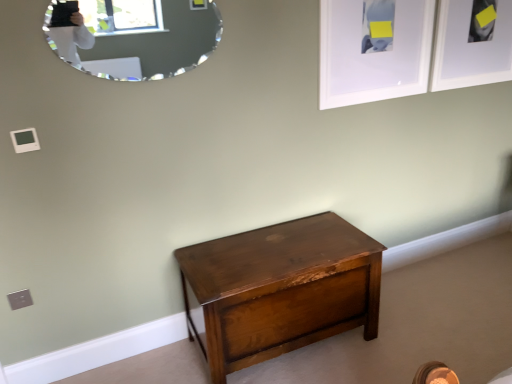
Where is `white matte picture frame at upper right, the second picture frame when ordered from right to left`? The image size is (512, 384). white matte picture frame at upper right, the second picture frame when ordered from right to left is located at coordinates (374, 50).

The height and width of the screenshot is (384, 512). Find the location of `white matte picture frame at upper right, which appears as the 2th picture frame when viewed from the left`. white matte picture frame at upper right, which appears as the 2th picture frame when viewed from the left is located at coordinates click(472, 43).

This screenshot has height=384, width=512. I want to click on silver-framed mirror at upper left, so click(x=136, y=37).

Which is closer, (260,264) or (203,15)?

Point (260,264) is positioned farther from the camera compared to point (203,15).

This screenshot has height=384, width=512. In order to click on mirror to the left of shiny brown wood chest at center in this screenshot , I will do `click(136, 37)`.

Is shiny brown wood chest at center facing towards silver-framed mirror at upper left?

No, shiny brown wood chest at center is not oriented towards silver-framed mirror at upper left.

Looking at this image, from a real-world perspective, which is physically above, shiny brown wood chest at center or silver-framed mirror at upper left?

silver-framed mirror at upper left, from a real-world perspective.

Is white matte picture frame at upper right, the second picture frame when ordered from right to left, facing away from silver-framed mirror at upper left?

white matte picture frame at upper right, the second picture frame when ordered from right to left, does not have its back to silver-framed mirror at upper left.

Who is shorter, white matte picture frame at upper right, the 1th picture frame positioned from the left, or silver-framed mirror at upper left?

silver-framed mirror at upper left is shorter.

Is white matte picture frame at upper right, the 1th picture frame positioned from the left, inside or outside of silver-framed mirror at upper left?

white matte picture frame at upper right, the 1th picture frame positioned from the left, is not inside silver-framed mirror at upper left, it's outside.

Between white matte picture frame at upper right, the second picture frame when ordered from right to left, and silver-framed mirror at upper left, which one appears on the left side from the viewer's perspective?

silver-framed mirror at upper left.

From a real-world perspective, is white matte picture frame at upper right, the 1th picture frame positioned from the left, physically below white matte picture frame at upper right, positioned as the first picture frame in right-to-left order?

No, from a real-world perspective, white matte picture frame at upper right, the 1th picture frame positioned from the left, is not below white matte picture frame at upper right, positioned as the first picture frame in right-to-left order.

Looking at this image, considering the relative sizes of white matte picture frame at upper right, the second picture frame when ordered from right to left, and white matte picture frame at upper right, positioned as the first picture frame in right-to-left order, in the image provided, is white matte picture frame at upper right, the second picture frame when ordered from right to left, shorter than white matte picture frame at upper right, positioned as the first picture frame in right-to-left order,?

In fact, white matte picture frame at upper right, the second picture frame when ordered from right to left, may be taller than white matte picture frame at upper right, positioned as the first picture frame in right-to-left order.

Considering the relative sizes of white matte picture frame at upper right, the 1th picture frame positioned from the left, and white matte picture frame at upper right, positioned as the first picture frame in right-to-left order, in the image provided, is white matte picture frame at upper right, the 1th picture frame positioned from the left, thinner than white matte picture frame at upper right, positioned as the first picture frame in right-to-left order,?

Indeed, white matte picture frame at upper right, the 1th picture frame positioned from the left, has a lesser width compared to white matte picture frame at upper right, positioned as the first picture frame in right-to-left order.

From the image's perspective, which is below, shiny brown wood chest at center or white matte picture frame at upper right, the second picture frame when ordered from right to left?

shiny brown wood chest at center.

Considering the sizes of shiny brown wood chest at center and white matte picture frame at upper right, the second picture frame when ordered from right to left, in the image, is shiny brown wood chest at center wider or thinner than white matte picture frame at upper right, the second picture frame when ordered from right to left,?

shiny brown wood chest at center is wider than white matte picture frame at upper right, the second picture frame when ordered from right to left.

Considering the relative positions of shiny brown wood chest at center and white matte picture frame at upper right, the second picture frame when ordered from right to left, in the image provided, is shiny brown wood chest at center behind white matte picture frame at upper right, the second picture frame when ordered from right to left,?

That is False.

Is shiny brown wood chest at center far away from white matte picture frame at upper right, the second picture frame when ordered from right to left?

No, shiny brown wood chest at center is not far from white matte picture frame at upper right, the second picture frame when ordered from right to left.

In the scene shown: Which object is closer to the camera taking this photo, white matte picture frame at upper right, which appears as the 2th picture frame when viewed from the left, or white matte picture frame at upper right, the 1th picture frame positioned from the left?

Positioned in front is white matte picture frame at upper right, the 1th picture frame positioned from the left.

Can white matte picture frame at upper right, the 1th picture frame positioned from the left, be found inside white matte picture frame at upper right, which appears as the 2th picture frame when viewed from the left?

Definitely not — white matte picture frame at upper right, the 1th picture frame positioned from the left, is not inside white matte picture frame at upper right, which appears as the 2th picture frame when viewed from the left.

In terms of width, does white matte picture frame at upper right, positioned as the first picture frame in right-to-left order, look wider or thinner when compared to white matte picture frame at upper right, the second picture frame when ordered from right to left?

Clearly, white matte picture frame at upper right, positioned as the first picture frame in right-to-left order, has more width compared to white matte picture frame at upper right, the second picture frame when ordered from right to left.

Which of these two, white matte picture frame at upper right, which appears as the 2th picture frame when viewed from the left, or white matte picture frame at upper right, the second picture frame when ordered from right to left, is bigger?

With larger size is white matte picture frame at upper right, which appears as the 2th picture frame when viewed from the left.

In terms of size, does white matte picture frame at upper right, which appears as the 2th picture frame when viewed from the left, appear bigger or smaller than shiny brown wood chest at center?

In the image, white matte picture frame at upper right, which appears as the 2th picture frame when viewed from the left, appears to be smaller than shiny brown wood chest at center.

Which object is closer to the camera taking this photo, white matte picture frame at upper right, positioned as the first picture frame in right-to-left order, or shiny brown wood chest at center?

shiny brown wood chest at center is closer to the camera.

Which point is more forward, (x=476, y=72) or (x=372, y=278)?

The point (x=372, y=278) is more forward.

Looking at their sizes, would you say white matte picture frame at upper right, which appears as the 2th picture frame when viewed from the left, is wider or thinner than shiny brown wood chest at center?

Considering their sizes, white matte picture frame at upper right, which appears as the 2th picture frame when viewed from the left, looks slimmer than shiny brown wood chest at center.

How many degrees apart are the facing directions of silver-framed mirror at upper left and white matte picture frame at upper right, positioned as the first picture frame in right-to-left order?

They differ by 1.79 degrees in their facing directions.

Which is more to the left, silver-framed mirror at upper left or white matte picture frame at upper right, positioned as the first picture frame in right-to-left order?

silver-framed mirror at upper left.

From the picture: Does silver-framed mirror at upper left have a smaller size compared to white matte picture frame at upper right, which appears as the 2th picture frame when viewed from the left?

Indeed, silver-framed mirror at upper left has a smaller size compared to white matte picture frame at upper right, which appears as the 2th picture frame when viewed from the left.

In the scene shown: Between silver-framed mirror at upper left and white matte picture frame at upper right, positioned as the first picture frame in right-to-left order, which one has smaller width?

With smaller width is white matte picture frame at upper right, positioned as the first picture frame in right-to-left order.

This screenshot has width=512, height=384. Identify the location of nightstand behind the silver-framed mirror at upper left. (280, 289).

From the image's perspective, count 1st picture frames upward from the silver-framed mirror at upper left and point to it. Please provide its 2D coordinates.

[(374, 50)]

Estimate the real-world distances between objects in this image. Which object is closer to white matte picture frame at upper right, positioned as the first picture frame in right-to-left order, shiny brown wood chest at center or white matte picture frame at upper right, the second picture frame when ordered from right to left?

white matte picture frame at upper right, the second picture frame when ordered from right to left, is closer to white matte picture frame at upper right, positioned as the first picture frame in right-to-left order.

From the image, which object appears to be nearer to shiny brown wood chest at center, silver-framed mirror at upper left or white matte picture frame at upper right, the second picture frame when ordered from right to left?

white matte picture frame at upper right, the second picture frame when ordered from right to left, is positioned closer to the anchor shiny brown wood chest at center.

Considering their positions, is silver-framed mirror at upper left positioned further to shiny brown wood chest at center than white matte picture frame at upper right, positioned as the first picture frame in right-to-left order?

white matte picture frame at upper right, positioned as the first picture frame in right-to-left order, is further to shiny brown wood chest at center.

Based on their spatial positions, is shiny brown wood chest at center or white matte picture frame at upper right, which appears as the 2th picture frame when viewed from the left, further from white matte picture frame at upper right, the 1th picture frame positioned from the left?

Among the two, shiny brown wood chest at center is located further to white matte picture frame at upper right, the 1th picture frame positioned from the left.

Which object lies nearer to the anchor point white matte picture frame at upper right, positioned as the first picture frame in right-to-left order, silver-framed mirror at upper left or white matte picture frame at upper right, the second picture frame when ordered from right to left?

white matte picture frame at upper right, the second picture frame when ordered from right to left, is positioned closer to the anchor white matte picture frame at upper right, positioned as the first picture frame in right-to-left order.

Looking at the image, which one is located closer to silver-framed mirror at upper left, shiny brown wood chest at center or white matte picture frame at upper right, which appears as the 2th picture frame when viewed from the left?

The object closer to silver-framed mirror at upper left is shiny brown wood chest at center.

Which object lies nearer to the anchor point shiny brown wood chest at center, white matte picture frame at upper right, positioned as the first picture frame in right-to-left order, or silver-framed mirror at upper left?

Among the two, silver-framed mirror at upper left is located nearer to shiny brown wood chest at center.

Considering their positions, is white matte picture frame at upper right, the 1th picture frame positioned from the left, positioned closer to silver-framed mirror at upper left than white matte picture frame at upper right, which appears as the 2th picture frame when viewed from the left?

white matte picture frame at upper right, the 1th picture frame positioned from the left, is positioned closer to the anchor silver-framed mirror at upper left.

Identify the location of picture frame between silver-framed mirror at upper left and white matte picture frame at upper right, positioned as the first picture frame in right-to-left order, from left to right. This screenshot has width=512, height=384. (374, 50).

I want to click on nightstand between silver-framed mirror at upper left and white matte picture frame at upper right, positioned as the first picture frame in right-to-left order, from left to right, so click(280, 289).

You are a GUI agent. You are given a task and a screenshot of the screen. Output one action in this format:
    pyautogui.click(x=<x>, y=<y>)
    Task: Click on the picture frame between white matte picture frame at upper right, which appears as the 2th picture frame when viewed from the left, and shiny brown wood chest at center in the up-down direction
    Image resolution: width=512 pixels, height=384 pixels.
    Given the screenshot: What is the action you would take?
    pyautogui.click(x=374, y=50)

Find the location of a particular element. mirror between white matte picture frame at upper right, the second picture frame when ordered from right to left, and shiny brown wood chest at center in the up-down direction is located at coordinates (136, 37).